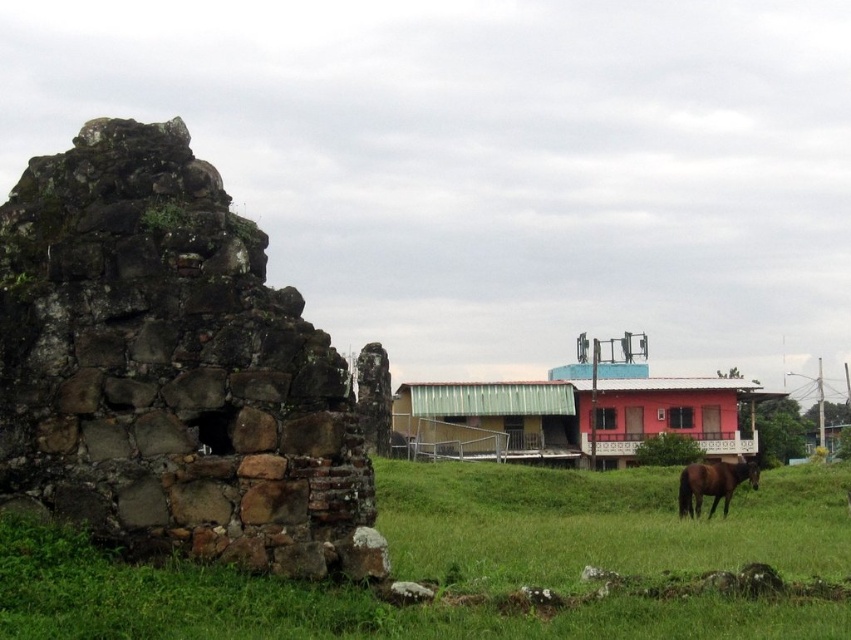
You are a photographer planning to capture a landscape that emphasizes the contrast between ancient and modern architecture. Given the scene described, which object should you focus on to highlight the size difference between the brown stone ruins at left and the green corrugated metal hut at center?

The brown stone ruins at left are smaller in size compared to the green corrugated metal hut at center, so focusing on the green corrugated metal hut at center would emphasize the size contrast between the ancient and modern structures.